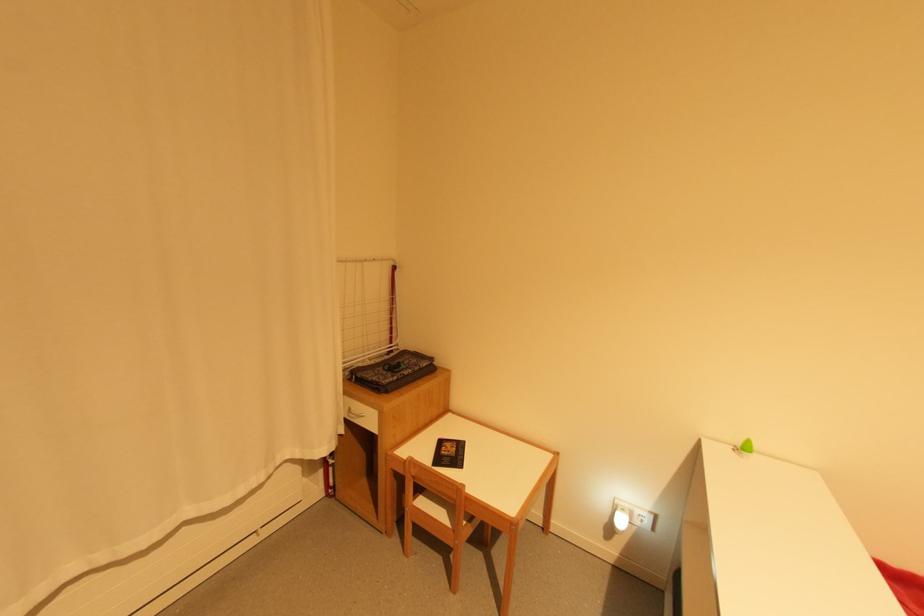
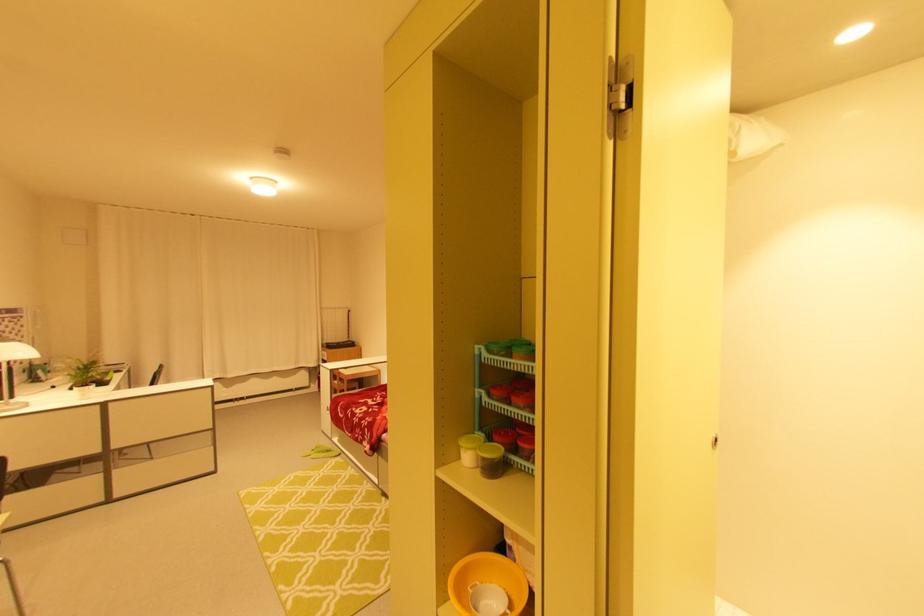
Which direction would the cameraman need to move to produce the second image?

The movement direction of the cameraman is right, backward.